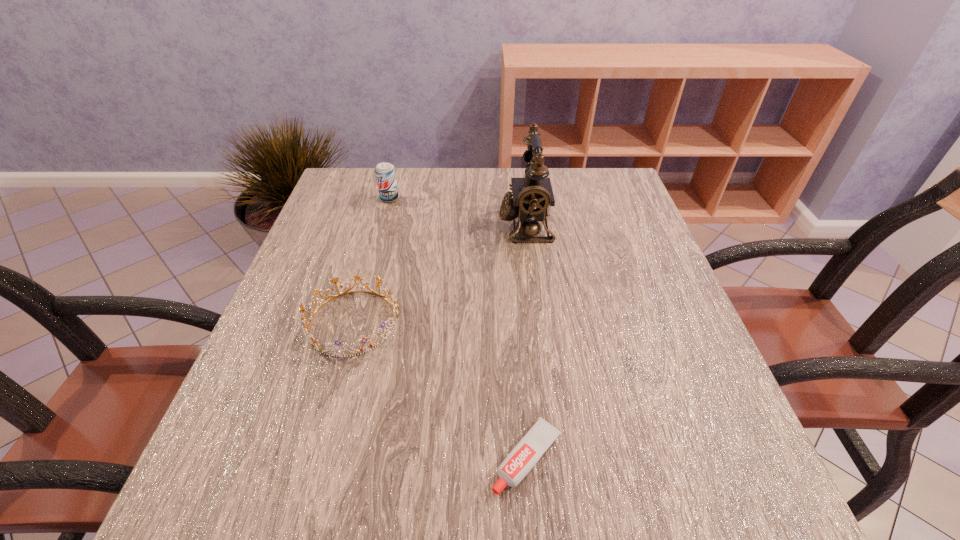
Find the location of a particular element. The width and height of the screenshot is (960, 540). vacant region that satisfies the following two spatial constraints: 1. on the back side of the toothpaste; 2. on the front-facing side of the tiara is located at coordinates (516, 322).

Where is `vacant position in the image that satisfies the following two spatial constraints: 1. on the front side of the beer can; 2. on the front-facing side of the second nearest object`? This screenshot has height=540, width=960. vacant position in the image that satisfies the following two spatial constraints: 1. on the front side of the beer can; 2. on the front-facing side of the second nearest object is located at coordinates (356, 322).

Where is `free point that satisfies the following two spatial constraints: 1. on the front-facing side of the nearest object; 2. on the left side of the third tallest object`? free point that satisfies the following two spatial constraints: 1. on the front-facing side of the nearest object; 2. on the left side of the third tallest object is located at coordinates (315, 458).

At what (x,y) coordinates should I click in order to perform the action: click on vacant space that satisfies the following two spatial constraints: 1. on the front-facing side of the third farthest object; 2. on the back side of the toothpaste. Please return your answer as a coordinate pair (x, y). Looking at the image, I should click on (315, 458).